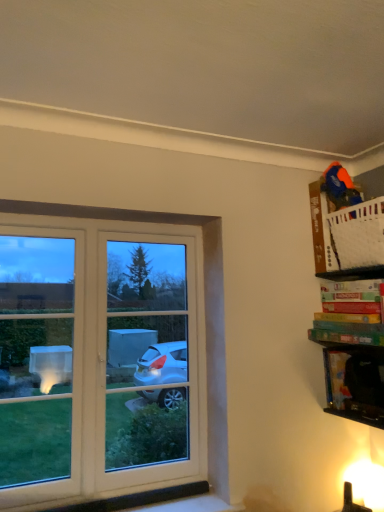
Question: Considering the relative positions of green matte board game at upper right, which is the first book in bottom-to-top order, and black plastic cabinet at lower right in the image provided, is green matte board game at upper right, which is the first book in bottom-to-top order, to the right of black plastic cabinet at lower right from the viewer's perspective?

Choices:
 (A) no
 (B) yes

Answer: (B)

Question: Are green matte board game at upper right, which is the first book in bottom-to-top order, and black plastic cabinet at lower right located far from each other?

Choices:
 (A) no
 (B) yes

Answer: (A)

Question: Does green matte board game at upper right, which is the first book in bottom-to-top order, have a greater width compared to black plastic cabinet at lower right?

Choices:
 (A) yes
 (B) no

Answer: (A)

Question: Does green matte board game at upper right, the second book from the top, come behind black plastic cabinet at lower right?

Choices:
 (A) yes
 (B) no

Answer: (B)

Question: Considering the relative sizes of green matte board game at upper right, the second book from the top, and black plastic cabinet at lower right in the image provided, is green matte board game at upper right, the second book from the top, smaller than black plastic cabinet at lower right?

Choices:
 (A) yes
 (B) no

Answer: (B)

Question: Looking at the image, does multicolored cardboard game at upper right, positioned as the second book in bottom-to-top order, seem bigger or smaller compared to black plastic cabinet at lower right?

Choices:
 (A) small
 (B) big

Answer: (B)

Question: Considering their positions, is multicolored cardboard game at upper right, placed as the first book when sorted from top to bottom, located in front of or behind black plastic cabinet at lower right?

Choices:
 (A) behind
 (B) front

Answer: (B)

Question: In terms of width, does multicolored cardboard game at upper right, positioned as the second book in bottom-to-top order, look wider or thinner when compared to black plastic cabinet at lower right?

Choices:
 (A) thin
 (B) wide

Answer: (B)

Question: Is multicolored cardboard game at upper right, placed as the first book when sorted from top to bottom, situated inside black plastic cabinet at lower right or outside?

Choices:
 (A) outside
 (B) inside

Answer: (A)

Question: Based on their sizes in the image, would you say multicolored cardboard game at upper right, positioned as the second book in bottom-to-top order, is bigger or smaller than green matte board game at upper right, the second book from the top?

Choices:
 (A) big
 (B) small

Answer: (A)

Question: Relative to green matte board game at upper right, the second book from the top, is multicolored cardboard game at upper right, positioned as the second book in bottom-to-top order, in front or behind?

Choices:
 (A) front
 (B) behind

Answer: (B)

Question: Is point (365, 282) positioned closer to the camera than point (367, 337)?

Choices:
 (A) farther
 (B) closer

Answer: (A)

Question: Is multicolored cardboard game at upper right, placed as the first book when sorted from top to bottom, taller or shorter than green matte board game at upper right, the second book from the top?

Choices:
 (A) short
 (B) tall

Answer: (B)

Question: From the image's perspective, is green matte board game at upper right, the second book from the top, located above or below multicolored cardboard game at upper right, positioned as the second book in bottom-to-top order?

Choices:
 (A) above
 (B) below

Answer: (B)

Question: Relative to multicolored cardboard game at upper right, placed as the first book when sorted from top to bottom, is green matte board game at upper right, the second book from the top, in front or behind?

Choices:
 (A) behind
 (B) front

Answer: (B)